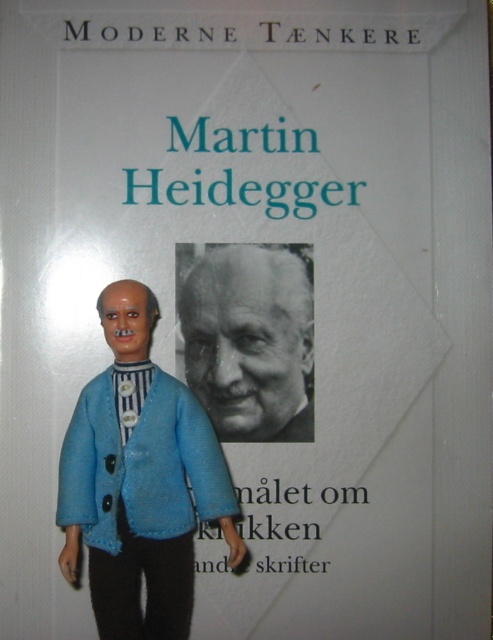
You are looking at a book cover and see a blue fabric doll at center and a black and white photograph of martin heidegger at center. Which one is positioned to the left?

The blue fabric doll at center is positioned to the left of the black and white photograph of martin heidegger at center.

You are an art student analyzing the book cover layout. You notice two points marked on the cover. The first point is at coordinate point (124, 506) and the second is at point (251, 300). Which point is closer to the viewer?

Point (124, 506) is in front of point (251, 300), so it is closer to the viewer.

You are designing a display for a childrens museum and need to place the blue fabric doll at center and the black and white photograph of martin heidegger at center on a shelf. The shelf has a width of 1 meter. Can both items fit side by side without overlapping?

The blue fabric doll at center might be wider than the black and white photograph of martin heidegger at center. Since the shelf is 1 meter wide, it depends on the combined width of both items. If the total width of both items is less than or equal to 1 meter, they can fit side by side. If the doll is wider and their combined width exceeds 1 meter, they might not fit without overlapping.